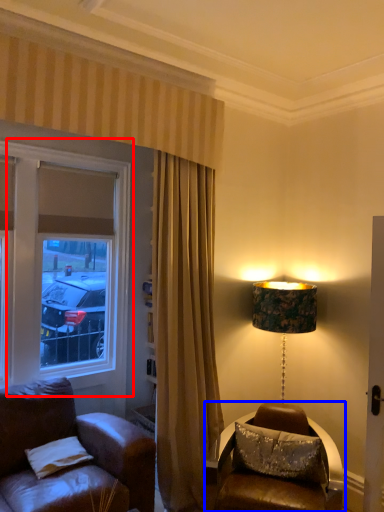
Question: Which object is closer to the camera taking this photo, window (highlighted by a red box) or table (highlighted by a blue box)?

Choices:
 (A) window
 (B) table

Answer: (B)